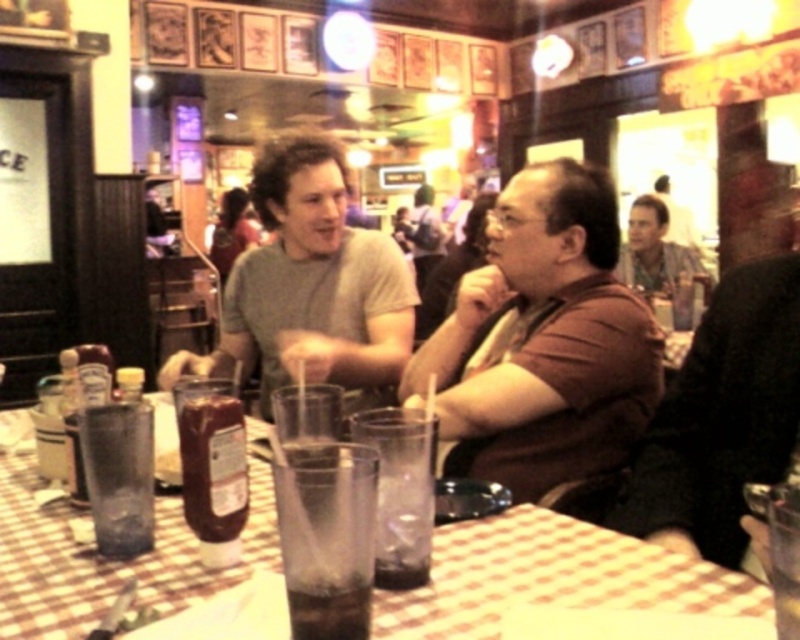
You are a waiter in a diner. You need to place a new menu that is 15 inches wide on the table. The table has a brown leather jacket at right and a dark brown liquid at table center. Can you fit the menu between them?

The brown leather jacket at right might be wider than dark brown liquid at table center. Since the menu is 15 inches wide, you need to check the distance between them. If the space between them is at least 15 inches, it can fit. However, since the jacket might be wider, it might reduce the available space. You should measure the actual distance to confirm.

Based on the photo, you are a customer sitting at the table in the diner. You want to grab the ketchup bottle but notice the brown matte shirt at center and the checkered fabric table at center. Which object is closer to you?

The brown matte shirt at center is closer to you because the checkered fabric table at center is behind it.